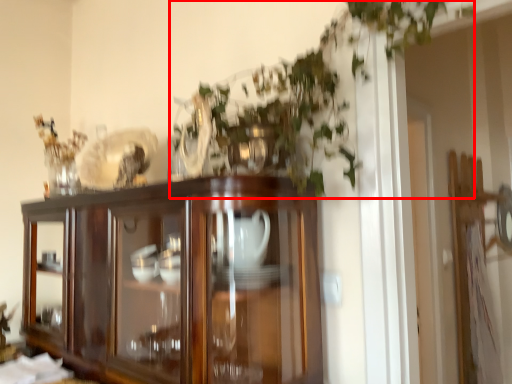
Question: From the image's perspective, what is the correct spatial positioning of vegetation (annotated by the red box) in reference to cupboard?

Choices:
 (A) above
 (B) below

Answer: (A)